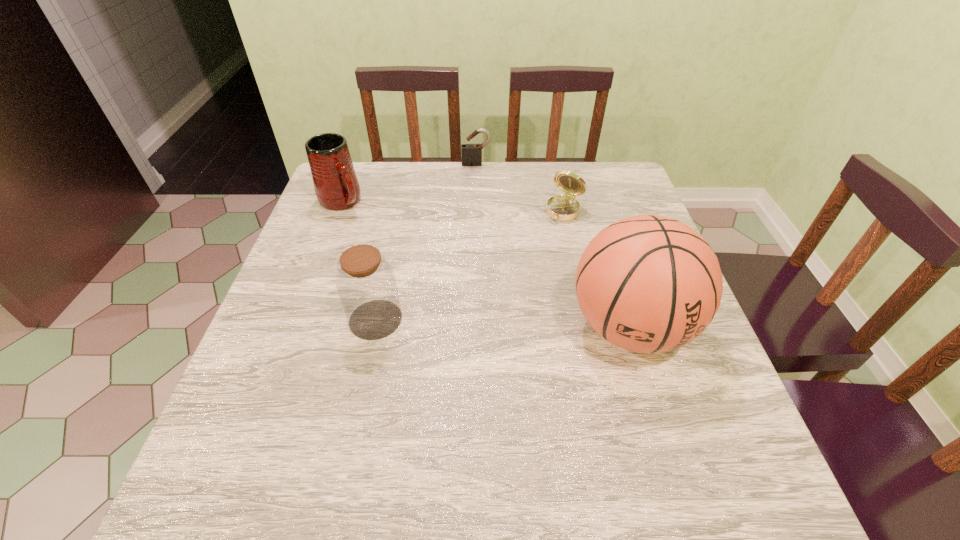
You are a GUI agent. You are given a task and a screenshot of the screen. Output one action in this format:
    pyautogui.click(x=<x>, y=<y>)
    Task: Click on the vacant space on the desktop that is between the jar and the basketball and is positioned with the dial facing the compass
    
    Given the screenshot: What is the action you would take?
    pos(481,322)

Where is `free spot on the desktop that is between the second object from left to right and the basketball and is positioned with the keyhole on the front of the farthest object`? The width and height of the screenshot is (960, 540). free spot on the desktop that is between the second object from left to right and the basketball and is positioned with the keyhole on the front of the farthest object is located at coordinates (487, 322).

Where is `vacant space on the desktop that is between the jar and the tallest object and is positioned on the side of the leftmost object with the handle`? Image resolution: width=960 pixels, height=540 pixels. vacant space on the desktop that is between the jar and the tallest object and is positioned on the side of the leftmost object with the handle is located at coordinates (474, 322).